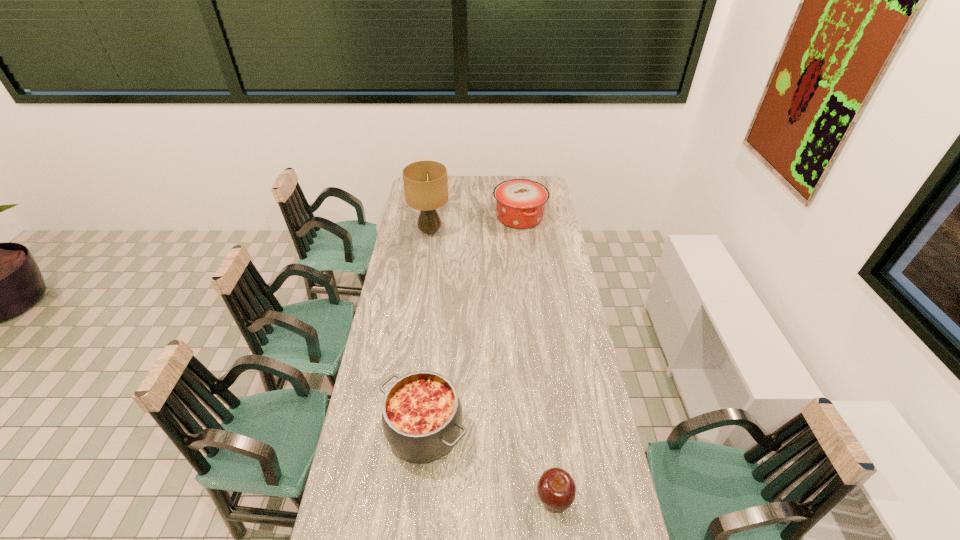
I want to click on lampshade, so click(425, 182).

This screenshot has width=960, height=540. I want to click on the farther casserole, so click(520, 203).

You are a GUI agent. You are given a task and a screenshot of the screen. Output one action in this format:
    pyautogui.click(x=<x>, y=<y>)
    Task: Click on the second nearest object
    
    Given the screenshot: What is the action you would take?
    click(421, 412)

You are a GUI agent. You are given a task and a screenshot of the screen. Output one action in this format:
    pyautogui.click(x=<x>, y=<y>)
    Task: Click on the left casserole
    The width and height of the screenshot is (960, 540).
    Given the screenshot: What is the action you would take?
    pyautogui.click(x=421, y=412)

In order to click on the shortest object in this screenshot , I will do `click(556, 488)`.

I want to click on apple, so click(556, 488).

Identify the location of vacant space located 0.200m on the front of the lampshade. Image resolution: width=960 pixels, height=540 pixels. (424, 270).

This screenshot has width=960, height=540. What are the coordinates of `vacant space located on the left of the farther casserole` in the screenshot? It's located at (432, 217).

This screenshot has height=540, width=960. I want to click on free region located on the back of the nearer casserole, so click(433, 346).

The height and width of the screenshot is (540, 960). Find the location of `free location located on the back of the nearest object`. free location located on the back of the nearest object is located at coordinates (541, 388).